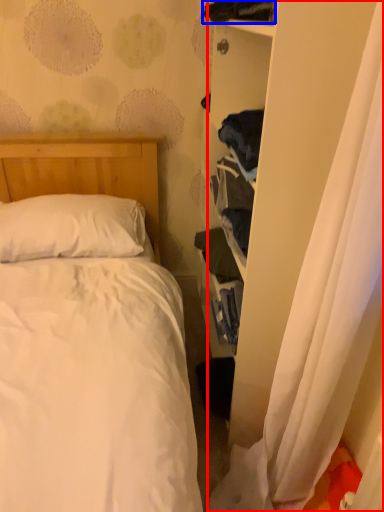
Question: Which object is further to the camera taking this photo, curtain (highlighted by a red box) or clothing (highlighted by a blue box)?

Choices:
 (A) curtain
 (B) clothing

Answer: (B)